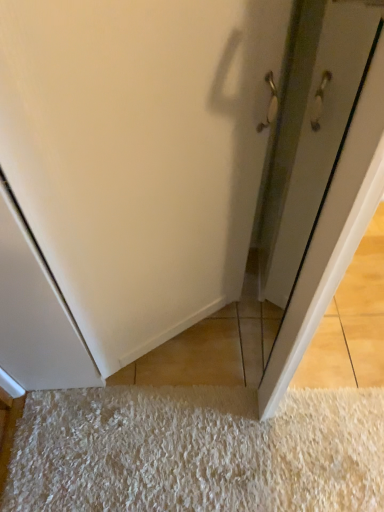
What do you see at coordinates (332, 234) in the screenshot? I see `white glossy door at center` at bounding box center [332, 234].

Where is `white glossy door at center`? This screenshot has width=384, height=512. white glossy door at center is located at coordinates (332, 234).

The height and width of the screenshot is (512, 384). Describe the element at coordinates (196, 451) in the screenshot. I see `white shaggy rug at lower center` at that location.

At what (x,y) coordinates should I click in order to perform the action: click on white shaggy rug at lower center. Please return your answer as a coordinate pair (x, y). Image resolution: width=384 pixels, height=512 pixels. Looking at the image, I should click on (196, 451).

You are a GUI agent. You are given a task and a screenshot of the screen. Output one action in this format:
    pyautogui.click(x=<x>, y=<y>)
    Task: Click on the white glossy door at center
    Image resolution: width=384 pixels, height=512 pixels.
    Given the screenshot: What is the action you would take?
    pyautogui.click(x=332, y=234)

Which is more to the left, white glossy door at center or white shaggy rug at lower center?

Positioned to the left is white shaggy rug at lower center.

Considering the positions of objects white glossy door at center and white shaggy rug at lower center in the image provided, who is behind, white glossy door at center or white shaggy rug at lower center?

white shaggy rug at lower center is further from the camera.

Is point (316, 294) closer to camera compared to point (160, 416)?

Yes, it is in front of point (160, 416).

From the picture: From the image's perspective, who appears lower, white glossy door at center or white shaggy rug at lower center?

white shaggy rug at lower center, from the image's perspective.

From a real-world perspective, is white glossy door at center under white shaggy rug at lower center?

Actually, white glossy door at center is physically above white shaggy rug at lower center in the real world.

In terms of width, does white glossy door at center look wider or thinner when compared to white shaggy rug at lower center?

white glossy door at center is thinner than white shaggy rug at lower center.

Considering the relative sizes of white glossy door at center and white shaggy rug at lower center in the image provided, is white glossy door at center taller than white shaggy rug at lower center?

Yes.

Who is smaller, white glossy door at center or white shaggy rug at lower center?

white shaggy rug at lower center is smaller.

From the picture: Is white glossy door at center not within white shaggy rug at lower center?

Yes, white glossy door at center is outside of white shaggy rug at lower center.

Is white glossy door at center next to white shaggy rug at lower center?

white glossy door at center and white shaggy rug at lower center are not in contact.

Is white glossy door at center aimed at white shaggy rug at lower center?

No, white glossy door at center is not facing towards white shaggy rug at lower center.

The image size is (384, 512). What are the coordinates of `mat that is on the left side of white glossy door at center` in the screenshot? It's located at (196, 451).

Which object is positioned more to the left, white shaggy rug at lower center or white glossy door at center?

white shaggy rug at lower center is more to the left.

Is white shaggy rug at lower center behind white glossy door at center?

Yes, it is.

Does point (114, 460) appear closer or farther from the camera than point (284, 329)?

Point (114, 460) appears to be farther away from the viewer than point (284, 329).

From the image's perspective, is white shaggy rug at lower center below white glossy door at center?

Yes.

From a real-world perspective, is white shaggy rug at lower center under white glossy door at center?

Indeed, from a real-world perspective, white shaggy rug at lower center is positioned beneath white glossy door at center.

Between white shaggy rug at lower center and white glossy door at center, which one has smaller width?

Thinner between the two is white glossy door at center.

From their relative heights in the image, would you say white shaggy rug at lower center is taller or shorter than white glossy door at center?

In the image, white shaggy rug at lower center appears to be shorter than white glossy door at center.

Between white shaggy rug at lower center and white glossy door at center, which one has smaller size?

Smaller between the two is white shaggy rug at lower center.

Is white glossy door at center a part of white shaggy rug at lower center?

That's incorrect, white glossy door at center is not inside white shaggy rug at lower center.

Is white shaggy rug at lower center next to white glossy door at center?

No, white shaggy rug at lower center is not next to white glossy door at center.

Is white shaggy rug at lower center oriented away from white glossy door at center?

No.

Can you tell me how much white shaggy rug at lower center and white glossy door at center differ in facing direction?

The angle between the facing direction of white shaggy rug at lower center and the facing direction of white glossy door at center is 90.7 degrees.

How far apart are white shaggy rug at lower center and white glossy door at center?

A distance of 39.72 centimeters exists between white shaggy rug at lower center and white glossy door at center.

Find the location of a particular element. mat below the white glossy door at center (from the image's perspective) is located at coordinates (196, 451).

In the image, there is a white shaggy rug at lower center. Find the location of `door above it (from the image's perspective)`. door above it (from the image's perspective) is located at coordinates (332, 234).

Identify the location of door in front of the white shaggy rug at lower center. The height and width of the screenshot is (512, 384). (332, 234).